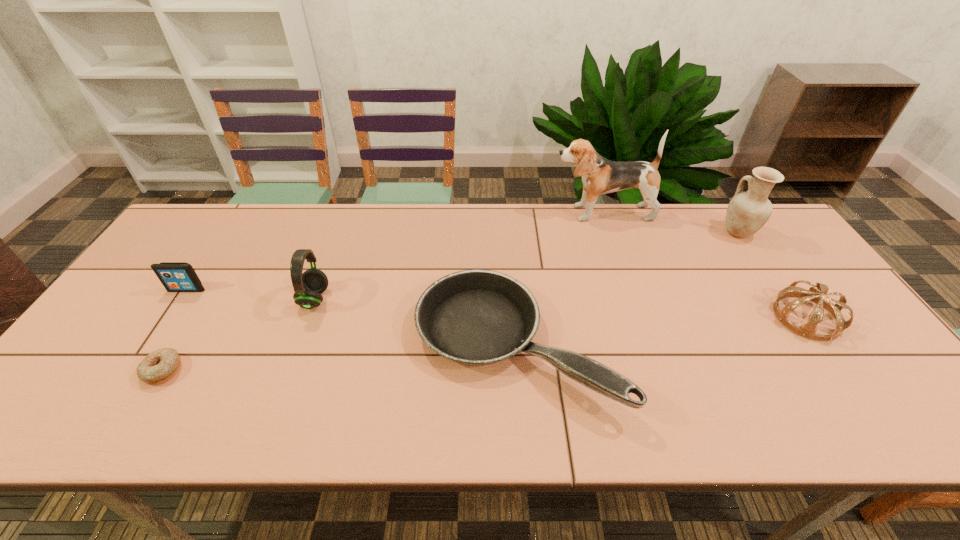
The height and width of the screenshot is (540, 960). Find the location of `free point between the frying pan and the tiara`. free point between the frying pan and the tiara is located at coordinates (660, 331).

Locate an element on the screen. free space between the frying pan and the iPod is located at coordinates (351, 317).

What are the coordinates of `unoccupied position between the tiara and the pottery` in the screenshot? It's located at (772, 274).

The height and width of the screenshot is (540, 960). Identify the location of unoccupied position between the frying pan and the tallest object. (559, 279).

Find the location of a particular element. This screenshot has height=540, width=960. vacant area between the pottery and the tiara is located at coordinates (772, 274).

Find the location of `vacant point located between the tallest object and the frying pan`. vacant point located between the tallest object and the frying pan is located at coordinates (559, 279).

This screenshot has height=540, width=960. Identify the location of object identified as the sixth closest to the puppy. (159, 366).

The width and height of the screenshot is (960, 540). What are the coordinates of `object that ranks as the fifth closest to the shortest object` in the screenshot? It's located at (808, 330).

Find the location of `free spot that satisfies the following two spatial constraints: 1. at the face of the tallest object; 2. on the front side of the frying pan`. free spot that satisfies the following two spatial constraints: 1. at the face of the tallest object; 2. on the front side of the frying pan is located at coordinates (646, 345).

Locate an element on the screen. This screenshot has width=960, height=540. free point that satisfies the following two spatial constraints: 1. on the ear cups of the third object from left to right; 2. on the right side of the tiara is located at coordinates (308, 318).